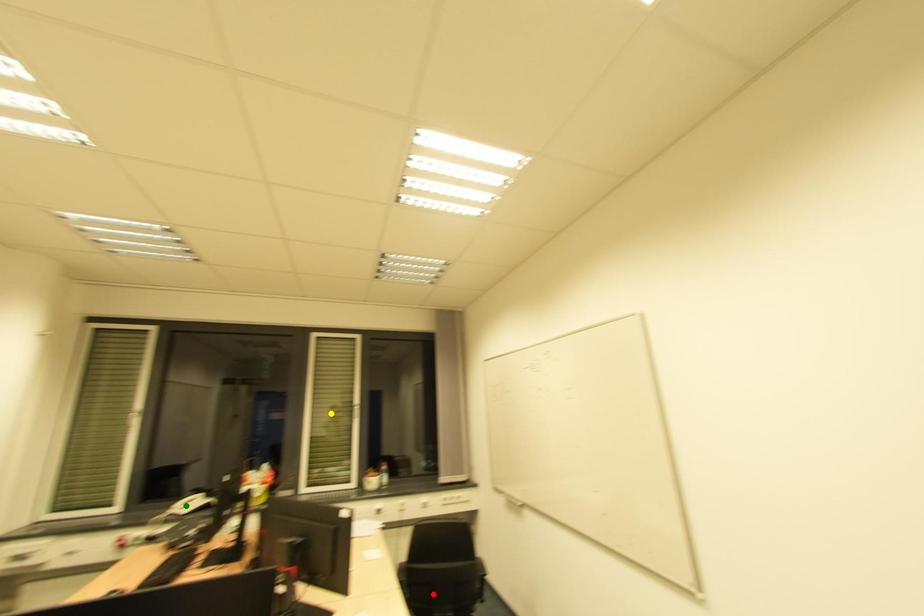
Order these from farthest to nearest:
1. green point
2. red point
3. yellow point

yellow point, green point, red point